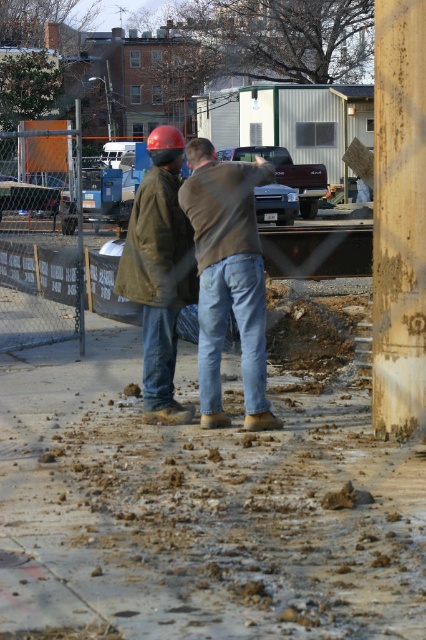
From the picture: Can you confirm if wooden pole at center right is wider than matte brown jacket at center?

No.

Consider the image. Which is below, wooden pole at center right or matte brown jacket at center?

Positioned lower is matte brown jacket at center.

Who is more distant from viewer, (411,132) or (166,138)?

The point (166,138) is behind.

Where is `wooden pole at center right`? The height and width of the screenshot is (640, 426). wooden pole at center right is located at coordinates (399, 218).

Which is below, orange chain-link fence at left or brown leather jacket at center?

Positioned lower is brown leather jacket at center.

Can you confirm if orange chain-link fence at left is thinner than brown leather jacket at center?

No, orange chain-link fence at left is not thinner than brown leather jacket at center.

Locate an element on the screen. The width and height of the screenshot is (426, 640). orange chain-link fence at left is located at coordinates (40, 240).

Who is shorter, muddy concrete at center or orange chain-link fence at left?

muddy concrete at center is shorter.

Does point (336, 522) come behind point (37, 298)?

No, (336, 522) is closer to viewer.

Image resolution: width=426 pixels, height=640 pixels. In order to click on muddy concrete at center in this screenshot , I will do `click(198, 508)`.